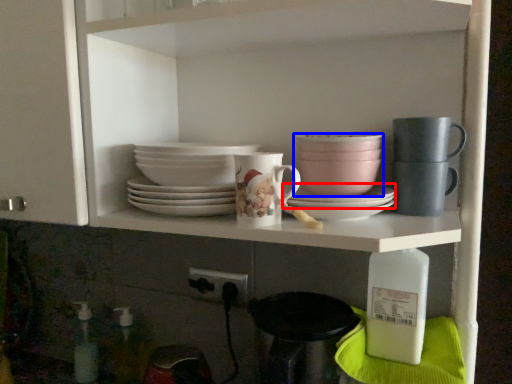
Question: Which object is closer to the camera taking this photo, platter (highlighted by a red box) or tableware (highlighted by a blue box)?

Choices:
 (A) platter
 (B) tableware

Answer: (A)